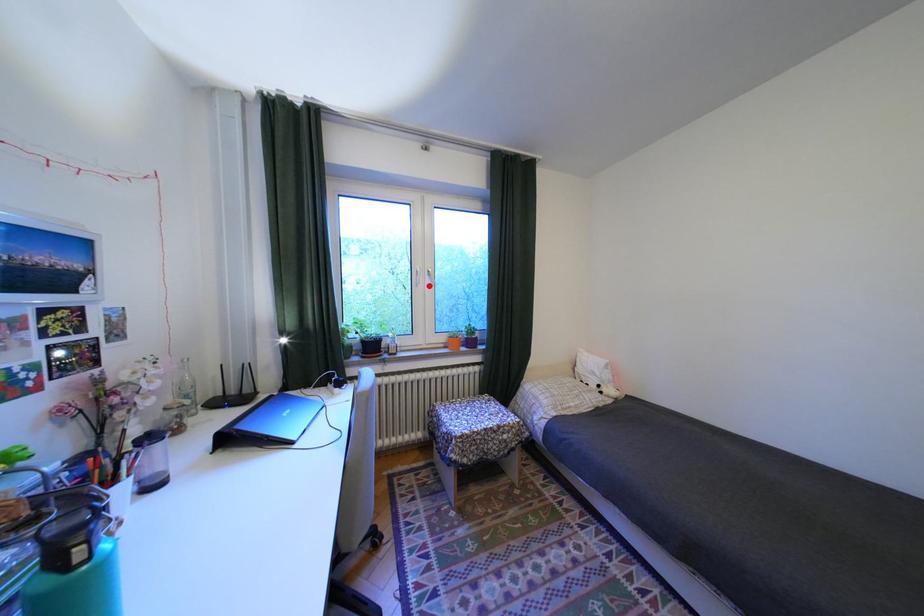
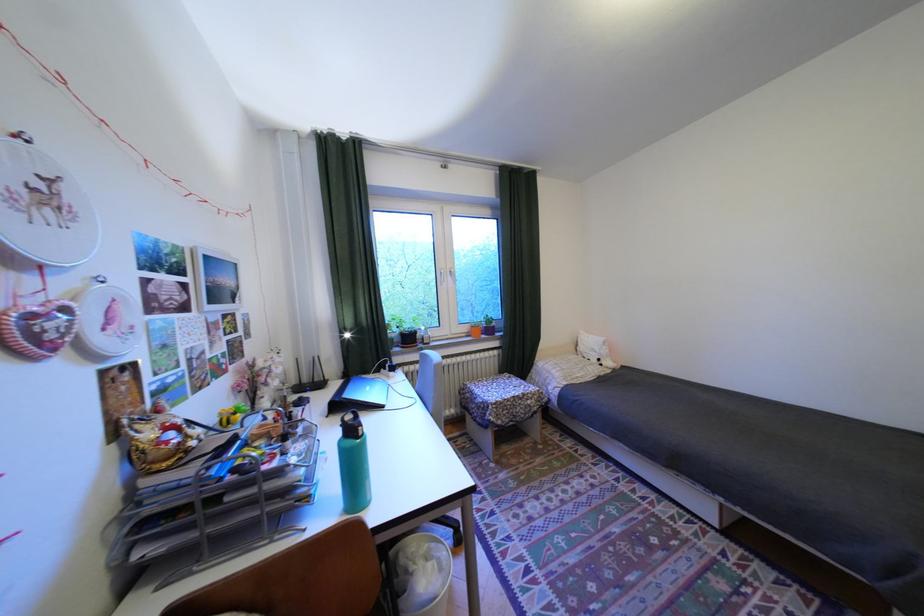
Locate, in the second image, the point that corresponds to the highlighted location in the first image.

(454, 285)